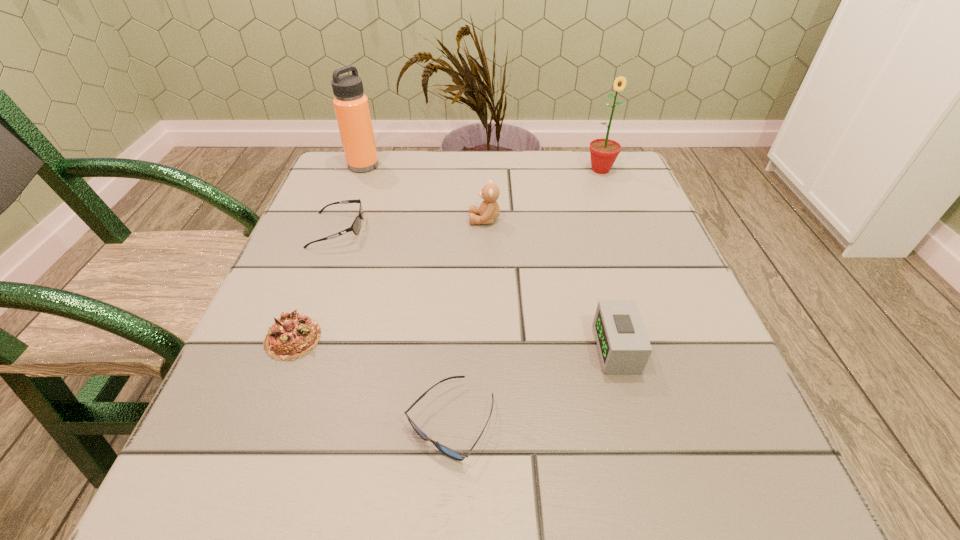
At what (x,y) coordinates should I click in order to perform the action: click on free spot that satisfies the following two spatial constraints: 1. on the face of the rightmost object; 2. on the front-facing side of the fifth shortest object. Please return your answer as a coordinate pair (x, y). Looking at the image, I should click on (619, 220).

You are a GUI agent. You are given a task and a screenshot of the screen. Output one action in this format:
    pyautogui.click(x=<x>, y=<y>)
    Task: Click on the vacant space that satisfies the following two spatial constraints: 1. on the front-facing side of the second object from right to left; 2. at the front of the nearest object showing the lenses
    Image resolution: width=960 pixels, height=540 pixels.
    Given the screenshot: What is the action you would take?
    pyautogui.click(x=636, y=422)

The image size is (960, 540). Identify the location of vacant position in the image that satisfies the following two spatial constraints: 1. on the face of the sunflower; 2. on the front-facing side of the teddy bear. (619, 220).